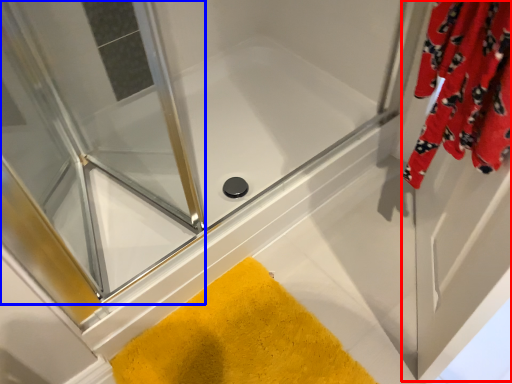
Question: Which object appears closest to the camera in this image, screen door (highlighted by a red box) or screen door (highlighted by a blue box)?

Choices:
 (A) screen door
 (B) screen door

Answer: (A)